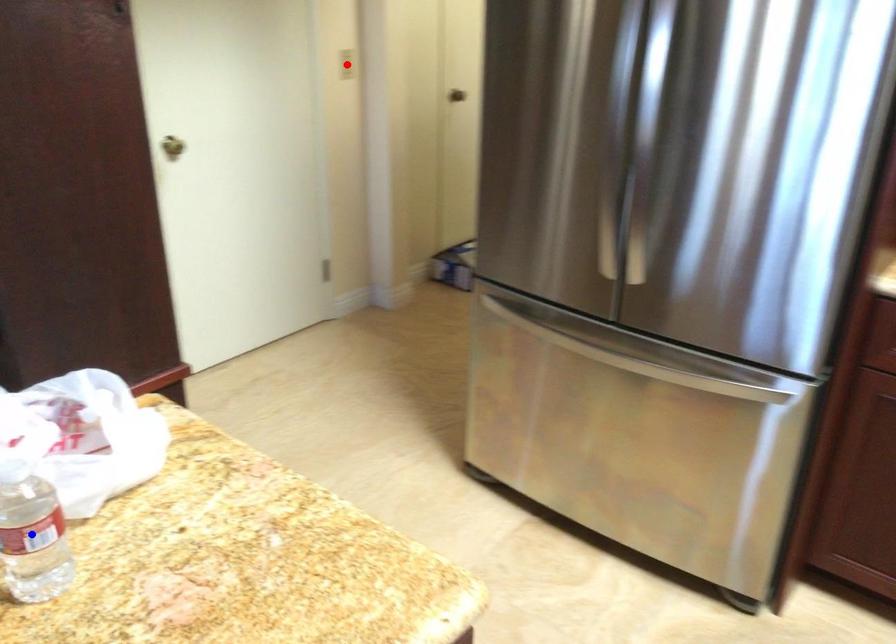
Question: Two points are marked on the image. Which point is closer to the camera?

Choices:
 (A) Blue point is closer.
 (B) Red point is closer.

Answer: (A)